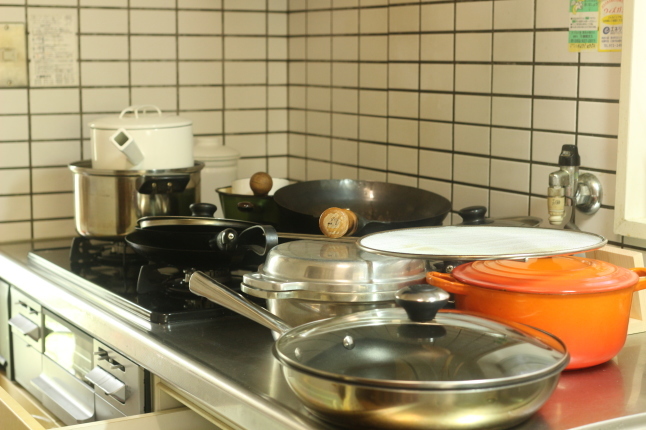
At what (x,y) coordinates should I click in order to perform the action: click on backsplash. Please return your answer as a coordinate pair (x, y). Image resolution: width=646 pixels, height=430 pixels. Looking at the image, I should click on (316, 86).